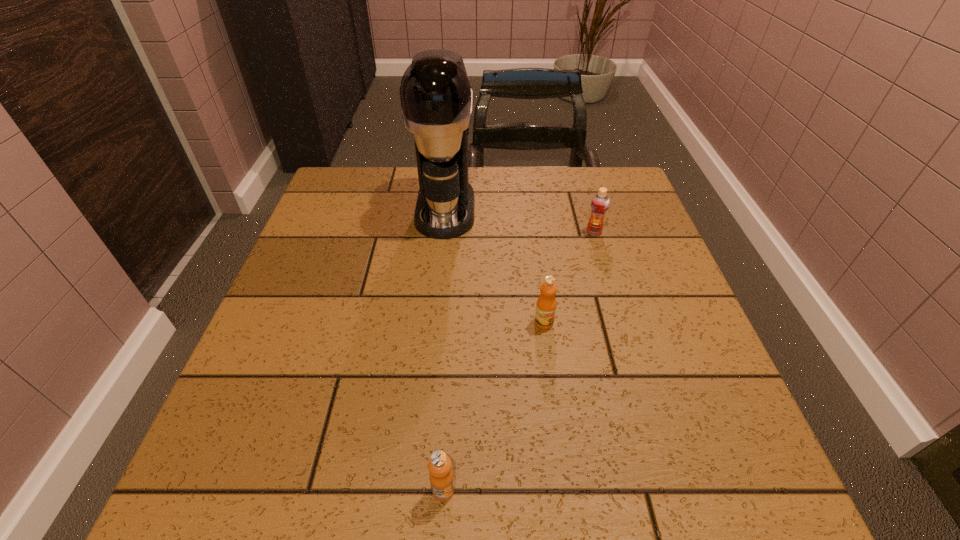
The image size is (960, 540). In order to click on vacant area between the leftmost orange juice and the second nearest orange juice in this screenshot , I will do `click(493, 406)`.

Locate an element on the screen. free space between the farthest orange juice and the leftmost orange juice is located at coordinates (518, 361).

Find the location of `free space between the tallest object and the second nearest object`. free space between the tallest object and the second nearest object is located at coordinates (494, 266).

I want to click on vacant area between the coffee maker and the rightmost orange juice, so click(519, 220).

The height and width of the screenshot is (540, 960). I want to click on free point between the nearest object and the rightmost object, so [x=518, y=361].

At what (x,y) coordinates should I click in order to perform the action: click on vacant space in between the second farthest orange juice and the tallest object. Please return your answer as a coordinate pair (x, y). Image resolution: width=960 pixels, height=540 pixels. Looking at the image, I should click on (494, 266).

Locate an element on the screen. free space between the farthest orange juice and the second orange juice from left to right is located at coordinates (569, 277).

Where is `vacant space in between the rightmost object and the tallest object`? The image size is (960, 540). vacant space in between the rightmost object and the tallest object is located at coordinates (519, 220).

Find the location of a particular element. The width and height of the screenshot is (960, 540). the second closest object to the third farthest object is located at coordinates (600, 202).

Point out which object is positioned as the second nearest to the rightmost object. Please provide its 2D coordinates. Your answer should be formatted as a tuple, i.e. [(x, y)], where the tuple contains the x and y coordinates of a point satisfying the conditions above.

[(546, 304)]